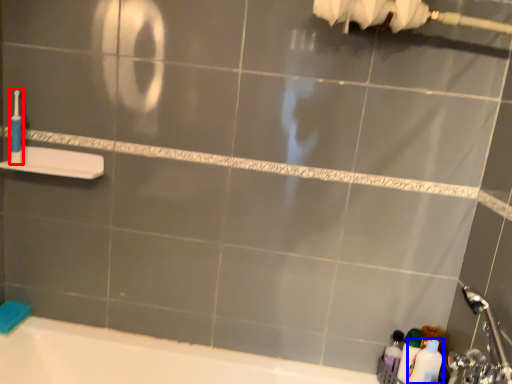
Question: Which of the following is the farthest to the observer, toothbrush (highlighted by a red box) or toiletry (highlighted by a blue box)?

Choices:
 (A) toothbrush
 (B) toiletry

Answer: (A)